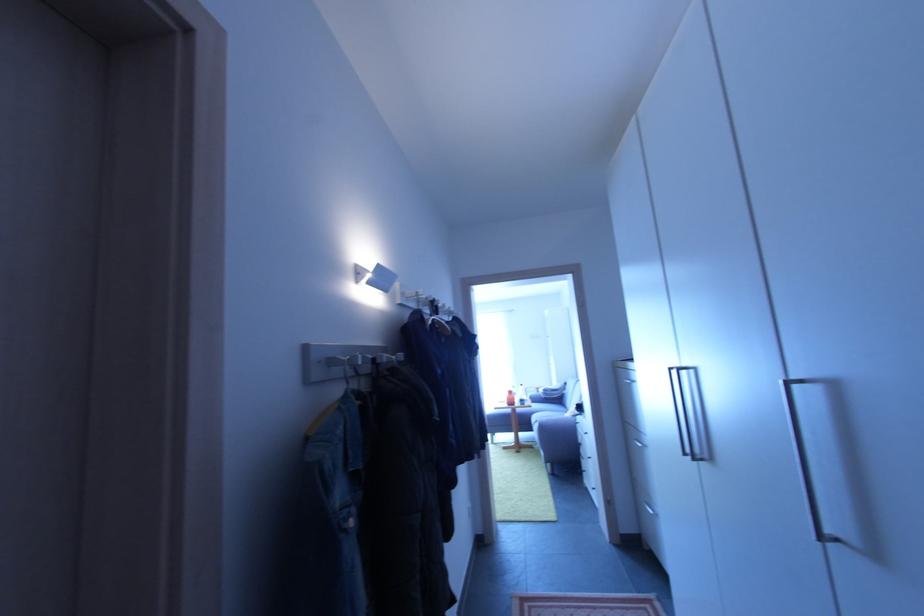
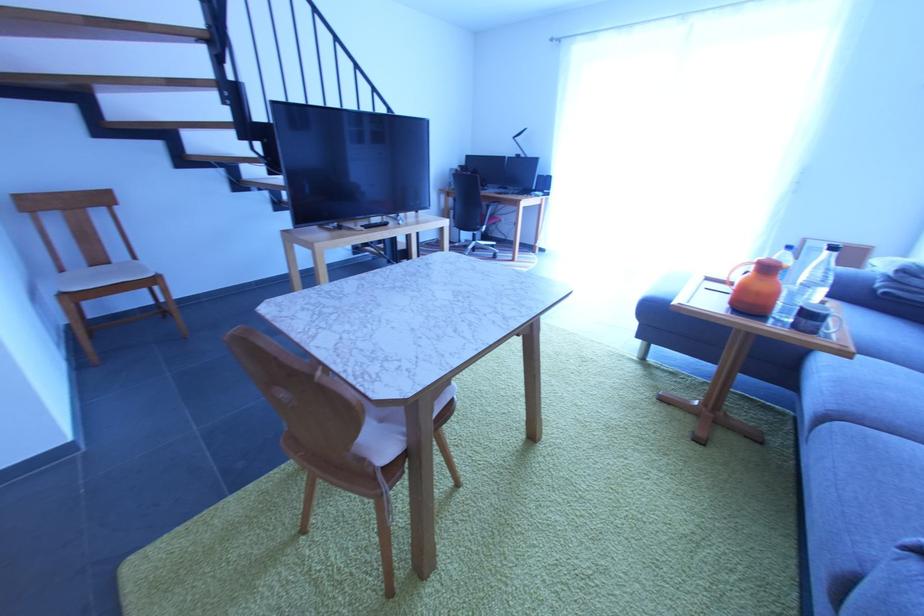
Where in the second image is the point corresponding to (518,400) from the first image?

(779, 297)